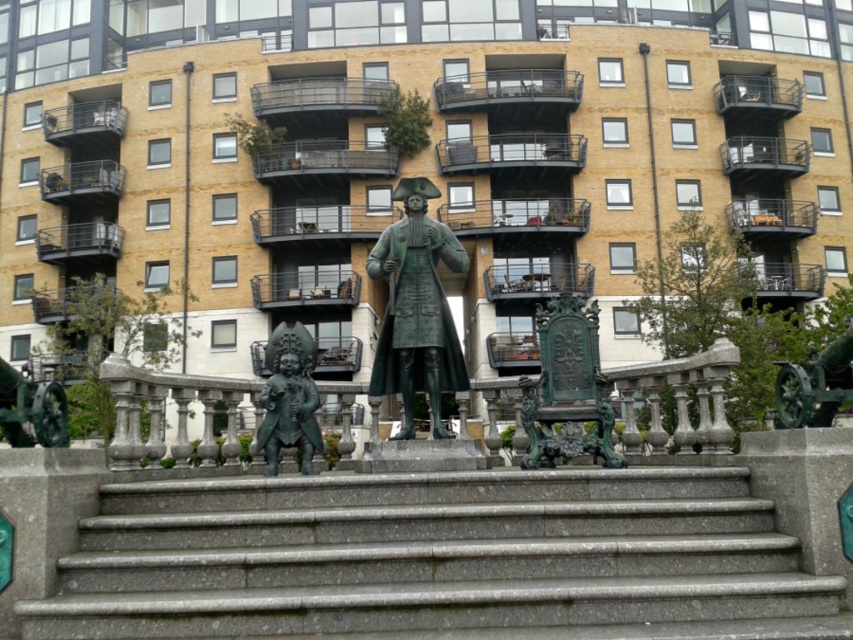
Please provide the coordinates of the green patinated bronze statue at center in the image. The answer should be in the format of coordinates in parentheses.

The coordinates of the green patinated bronze statue at center are at point (x=416, y=307).

You are standing in front of the historical statue scene. You see the green patinated bronze statue at center and the bronze statue at lower left. Which one is positioned to the right of the other?

The green patinated bronze statue at center is positioned to the right of bronze statue at lower left.